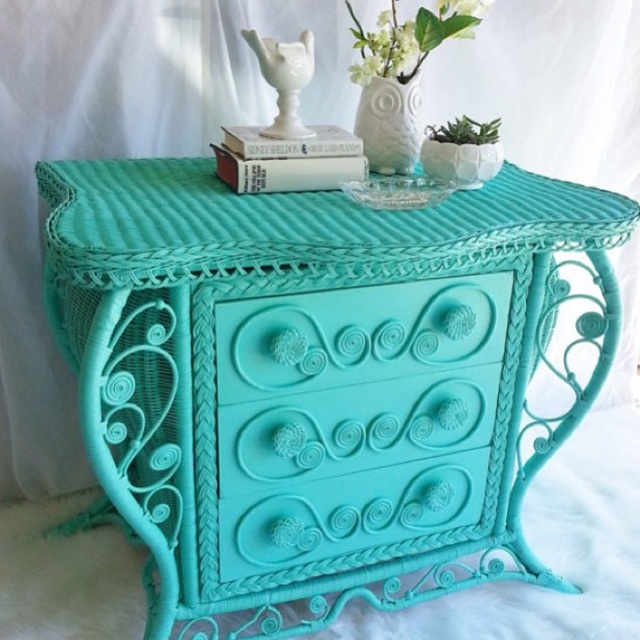
Question: Does turquoise matte drawer at center appear over white matte owl at center?

Choices:
 (A) no
 (B) yes

Answer: (A)

Question: Observing the image, what is the correct spatial positioning of turquoise wicker table at center in reference to white matte vase at upper center?

Choices:
 (A) above
 (B) below

Answer: (B)

Question: Is the position of turquoise matte drawer at center less distant than that of white matte owl at center?

Choices:
 (A) yes
 (B) no

Answer: (A)

Question: Among these objects, which one is nearest to the camera?

Choices:
 (A) hardcover book at center
 (B) turquoise wicker table at center
 (C) white matte owl at center

Answer: (B)

Question: Which point is closer to the camera taking this photo?

Choices:
 (A) (275, 269)
 (B) (385, 32)
 (C) (346, 353)

Answer: (A)

Question: Which object is the farthest from the turquoise matte drawer at center?

Choices:
 (A) turquoise wicker table at center
 (B) white matte owl at center

Answer: (B)